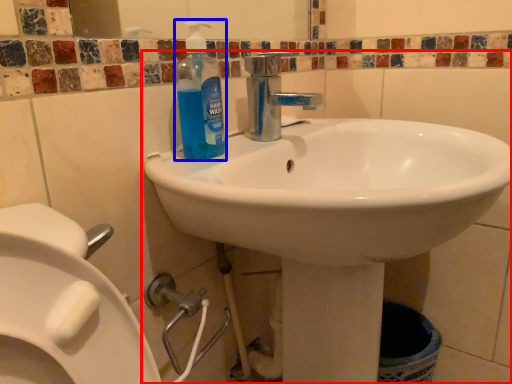
Question: Which of the following is the closest to the observer, sink (highlighted by a red box) or cleaning product (highlighted by a blue box)?

Choices:
 (A) sink
 (B) cleaning product

Answer: (A)